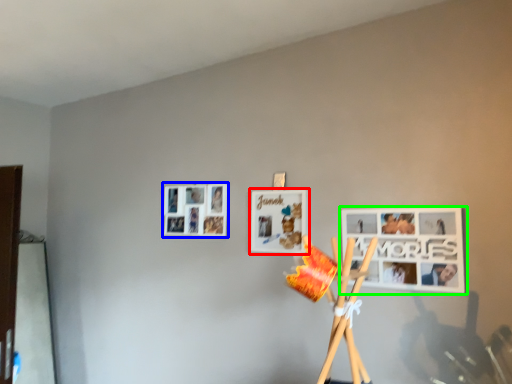
Question: Considering the real-world distances, which object is farthest from picture frame (highlighted by a red box)? picture frame (highlighted by a blue box) or picture frame (highlighted by a green box)?

Choices:
 (A) picture frame
 (B) picture frame

Answer: (B)